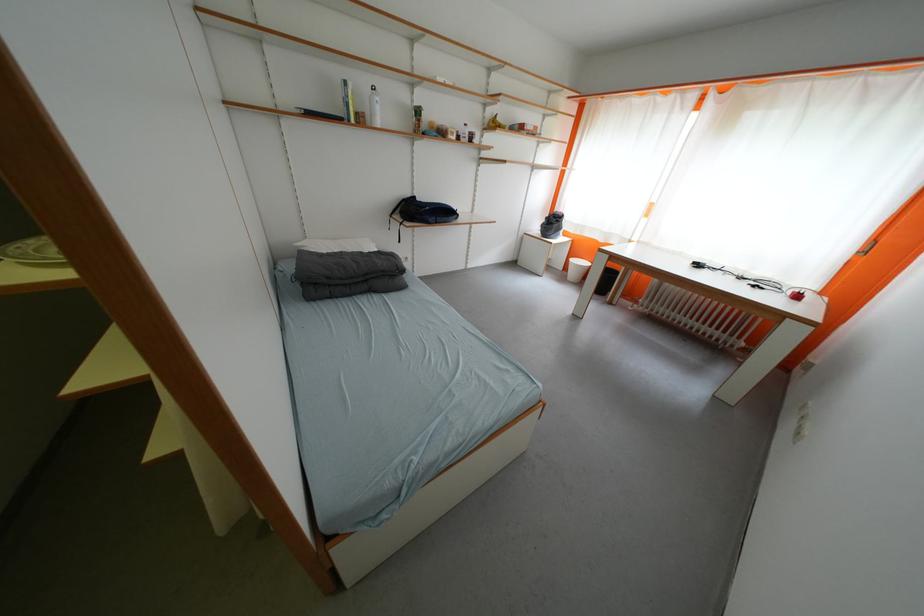
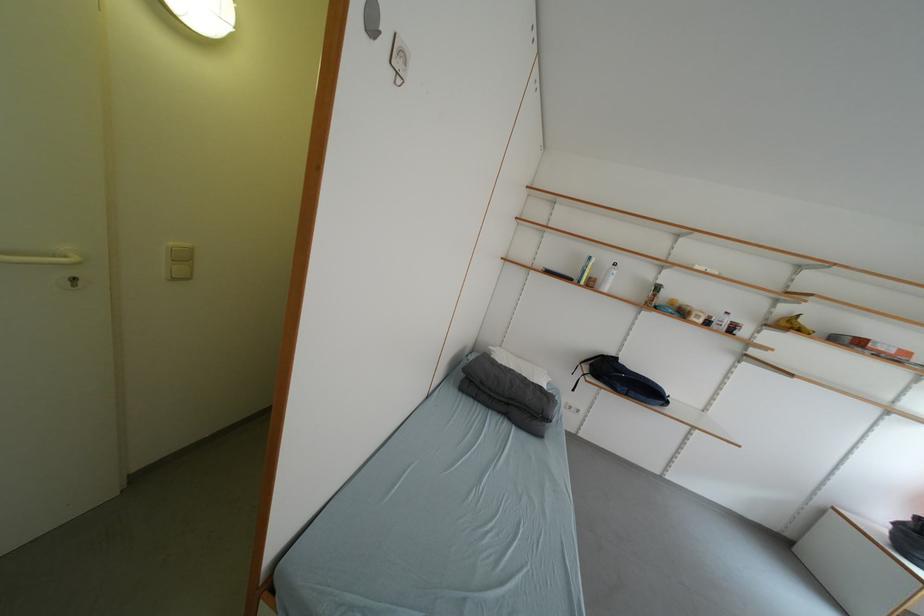
Locate, in the second image, the point that corresponds to pixel 530 241 in the first image.

(832, 515)